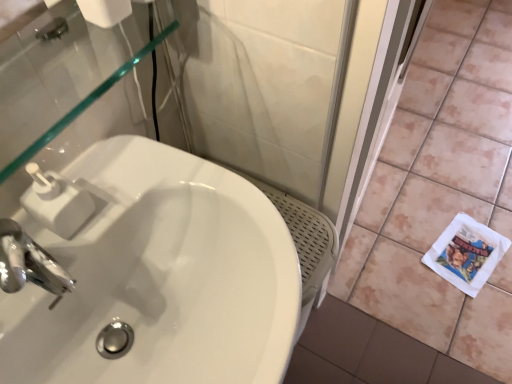
Identify the location of vacant space behind white plastic soap dispenser at upper left. The image size is (512, 384). (112, 167).